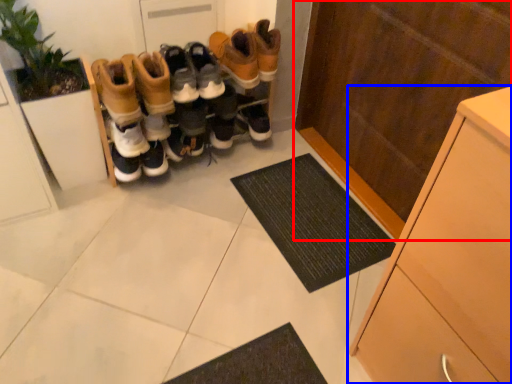
Question: Which object appears closest to the camera in this image, cupboard (highlighted by a red box) or cabinetry (highlighted by a blue box)?

Choices:
 (A) cupboard
 (B) cabinetry

Answer: (B)